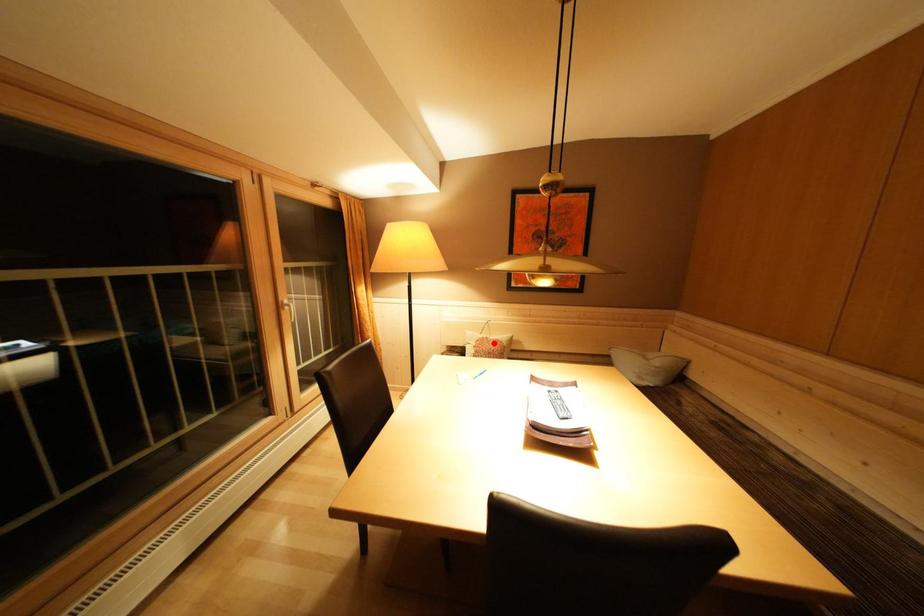
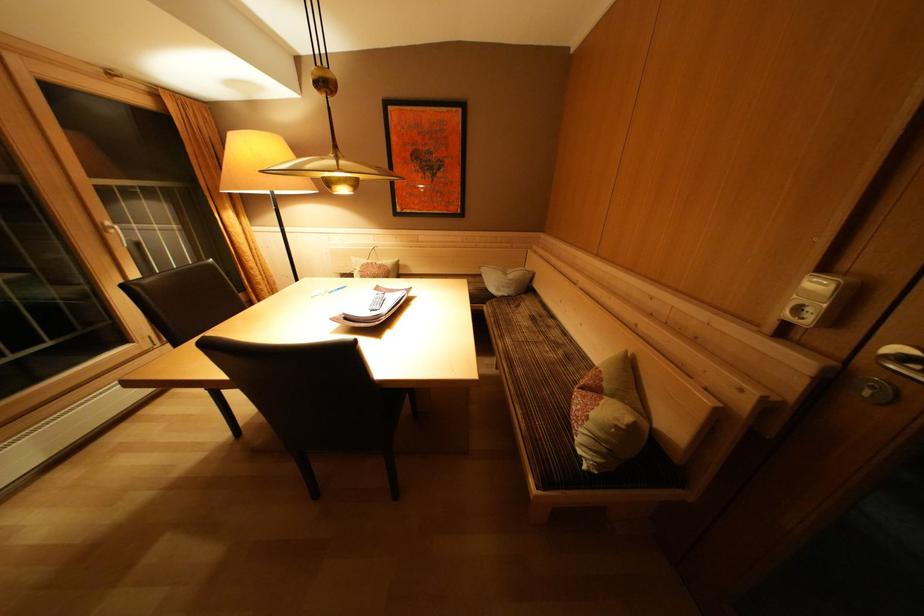
Question: I am providing you with two images of the same scene from different viewpoints. In image1, a red point is highlighted. Considering the same 3D point in image2, which of the following is correct?

Choices:
 (A) It is closer
 (B) It is farther

Answer: (A)